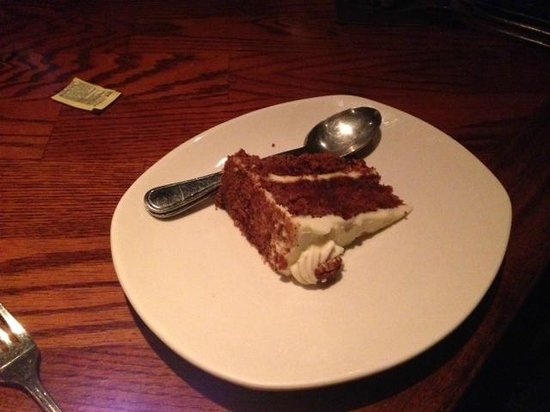
Locate an element on the screen. plate is located at coordinates (356, 299).